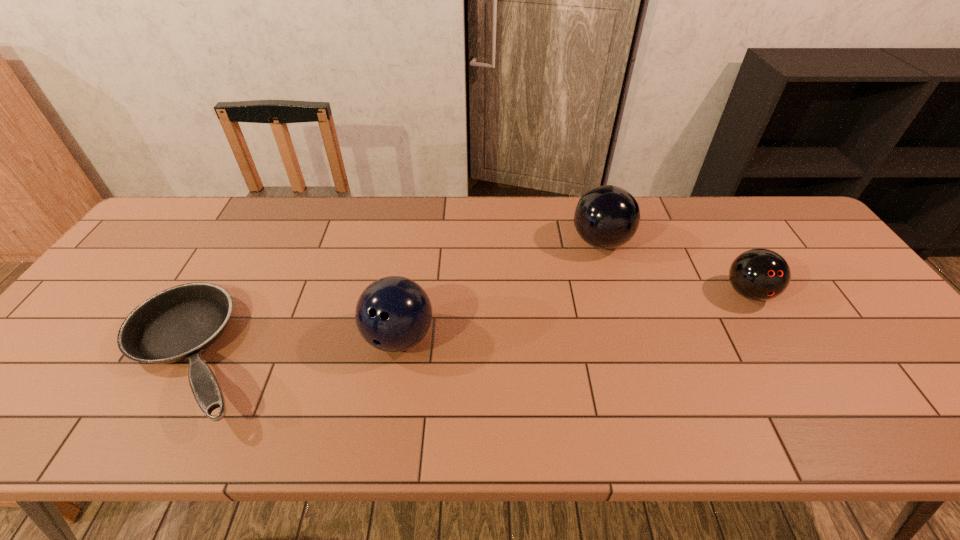
Where is `vacant space that satisfies the following two spatial constraints: 1. on the side of the farthest object with the finger holes; 2. on the surface of the third object from right to left near the finger holes`? vacant space that satisfies the following two spatial constraints: 1. on the side of the farthest object with the finger holes; 2. on the surface of the third object from right to left near the finger holes is located at coordinates (629, 337).